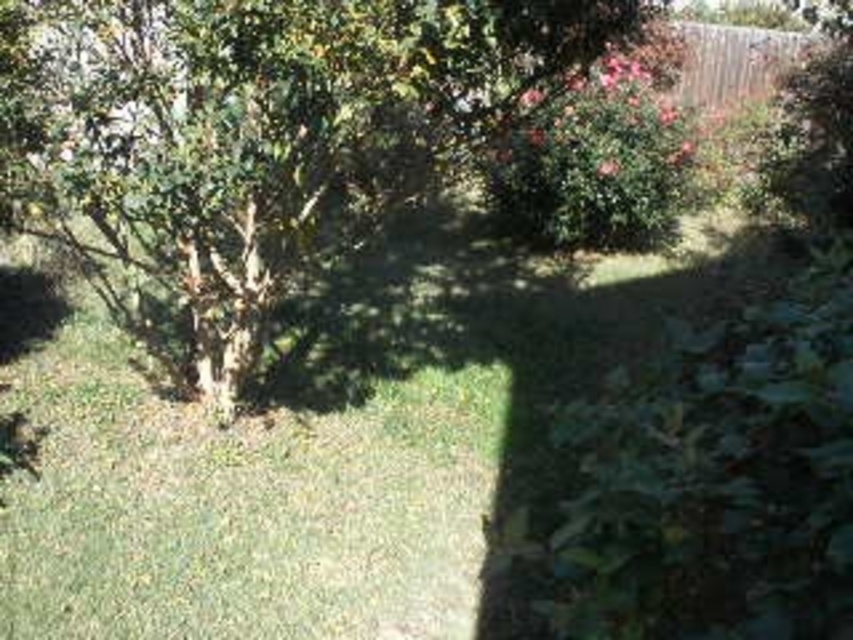
Question: Is green leafy tree at center below green leafy bush at upper center?

Choices:
 (A) yes
 (B) no

Answer: (A)

Question: Is green leafy tree at center thinner than green leafy bush at upper center?

Choices:
 (A) yes
 (B) no

Answer: (B)

Question: Which point is closer to the camera?

Choices:
 (A) green leafy bush at upper center
 (B) green leafy tree at center

Answer: (B)

Question: Which point is closer to the camera taking this photo?

Choices:
 (A) (500, 138)
 (B) (416, 35)

Answer: (B)

Question: Does green leafy tree at center appear under green leafy bush at upper center?

Choices:
 (A) no
 (B) yes

Answer: (B)

Question: Among these objects, which one is farthest from the camera?

Choices:
 (A) green leafy bush at upper center
 (B) green leafy tree at center

Answer: (A)